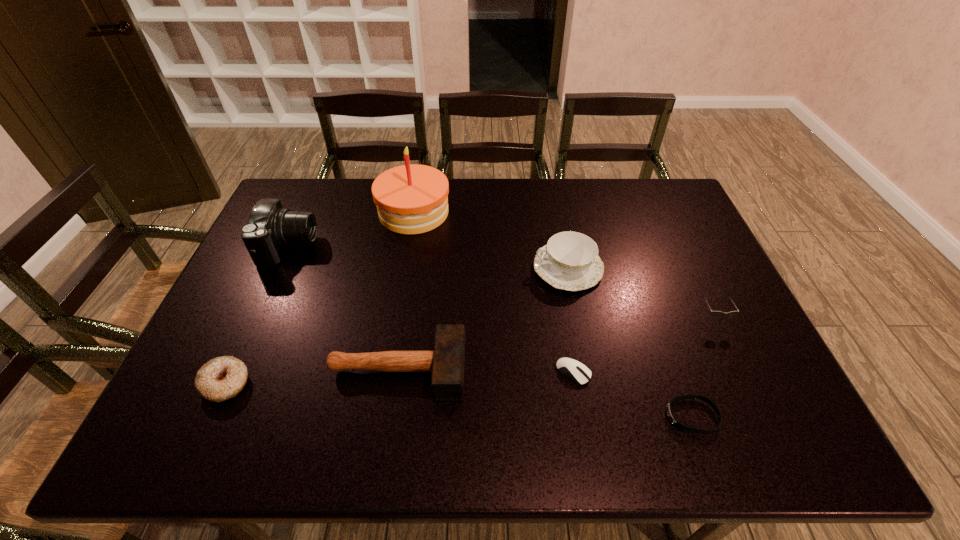
Image resolution: width=960 pixels, height=540 pixels. In the image, there is a desktop. What are the coordinates of `free space at the right edge` in the screenshot? It's located at (661, 228).

You are a GUI agent. You are given a task and a screenshot of the screen. Output one action in this format:
    pyautogui.click(x=<x>, y=<y>)
    Task: Click on the vacant space at the far left corner of the desktop
    The height and width of the screenshot is (540, 960).
    Given the screenshot: What is the action you would take?
    pyautogui.click(x=293, y=181)

I want to click on free area in between the chinaware and the camera, so click(x=428, y=258).

In order to click on free space between the mallet and the sunglasses in this screenshot , I will do `click(555, 344)`.

Where is `free space between the wristband and the sunglasses`? free space between the wristband and the sunglasses is located at coordinates (702, 367).

Identify the location of free point between the chinaware and the birthday cake. (491, 240).

Locate an element on the screen. Image resolution: width=960 pixels, height=540 pixels. free space between the doughnut and the mouse is located at coordinates (399, 378).

You are a GUI agent. You are given a task and a screenshot of the screen. Output one action in this format:
    pyautogui.click(x=<x>, y=<y>)
    Task: Click on the empty space that is in between the fourth farthest object and the mouse
    
    Given the screenshot: What is the action you would take?
    pyautogui.click(x=643, y=345)

You are a GUI agent. You are given a task and a screenshot of the screen. Output one action in this format:
    pyautogui.click(x=<x>, y=<y>)
    Task: Click on the vacant area that lies between the chinaware and the sixth tallest object
    
    Given the screenshot: What is the action you would take?
    [x=396, y=326]

Identify the location of vacant space in between the chinaware and the wristband. This screenshot has height=540, width=960. (630, 342).